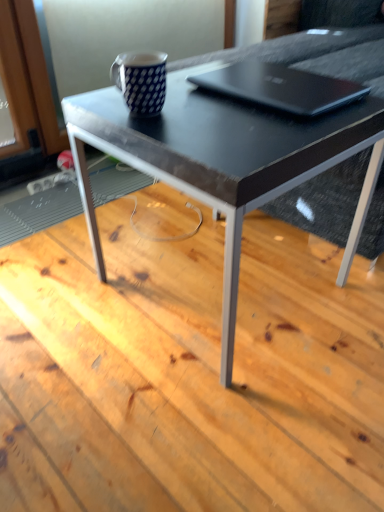
What do you see at coordinates (129, 34) in the screenshot?
I see `blue dotted mug at upper center` at bounding box center [129, 34].

What do you see at coordinates (224, 161) in the screenshot? This screenshot has width=384, height=512. I see `black glossy table at center` at bounding box center [224, 161].

The width and height of the screenshot is (384, 512). Find the location of `blue dotted mug at upper center`. blue dotted mug at upper center is located at coordinates (141, 81).

Find the location of a particular element. This screenshot has width=384, height=512. coffee cup positioned vertically above the black glossy table at center (from a real-world perspective) is located at coordinates click(141, 81).

Is black glossy table at center a part of blue dotted mug at upper center?

No, black glossy table at center is located outside of blue dotted mug at upper center.

Is blue dotted mug at upper center shorter than black glossy table at center?

Correct, blue dotted mug at upper center is not as tall as black glossy table at center.

In the image, is blue dotted mug at upper center on the left side or the right side of black glossy table at center?

From the image, it's evident that blue dotted mug at upper center is to the left of black glossy table at center.

Considering the sizes of black matte laptop at upper center and blue dotted mug at upper center in the image, is black matte laptop at upper center taller or shorter than blue dotted mug at upper center?

In the image, black matte laptop at upper center appears to be shorter than blue dotted mug at upper center.

What are the coordinates of `laptop below the blue dotted mug at upper center (from a real-world perspective)` in the screenshot? It's located at (281, 87).

Can blue dotted mug at upper center be found inside black matte laptop at upper center?

No, blue dotted mug at upper center is not inside black matte laptop at upper center.

Is black matte laptop at upper center in contact with blue dotted mug at upper center?

There is a gap between black matte laptop at upper center and blue dotted mug at upper center.

Is blue dotted mug at upper center wider than blue dotted mug at upper center?

In fact, blue dotted mug at upper center might be narrower than blue dotted mug at upper center.

Which of these two, blue dotted mug at upper center or blue dotted mug at upper center, is bigger?

Bigger between the two is blue dotted mug at upper center.

From the image's perspective, which is above, blue dotted mug at upper center or blue dotted mug at upper center?

blue dotted mug at upper center appears higher in the image.

Is blue dotted mug at upper center at the back of blue dotted mug at upper center?

No, blue dotted mug at upper center is not facing the opposite direction of blue dotted mug at upper center.

In terms of height, does black glossy table at center look taller or shorter compared to blue dotted mug at upper center?

Clearly, black glossy table at center is shorter compared to blue dotted mug at upper center.

Is black glossy table at center situated inside blue dotted mug at upper center or outside?

black glossy table at center is not enclosed by blue dotted mug at upper center.

From a real-world perspective, relative to blue dotted mug at upper center, is black glossy table at center vertically above or below?

From a real-world perspective, black glossy table at center is physically below blue dotted mug at upper center.

Between point (89, 136) and point (106, 0), which one is positioned in front?

The point (89, 136) is in front.

From their relative heights in the image, would you say blue dotted mug at upper center is taller or shorter than black matte laptop at upper center?

blue dotted mug at upper center is taller than black matte laptop at upper center.

Find the location of a particular element. The width and height of the screenshot is (384, 512). coffee cup on the left of the black matte laptop at upper center is located at coordinates (141, 81).

Is blue dotted mug at upper center bigger or smaller than black matte laptop at upper center?

Clearly, blue dotted mug at upper center is smaller in size than black matte laptop at upper center.

Is blue dotted mug at upper center positioned beyond the bounds of black matte laptop at upper center?

Absolutely, blue dotted mug at upper center is external to black matte laptop at upper center.

Is blue dotted mug at upper center touching black glossy table at center?

There is a gap between blue dotted mug at upper center and black glossy table at center.

Based on their positions, is blue dotted mug at upper center located to the left or right of black glossy table at center?

Based on their positions, blue dotted mug at upper center is located to the left of black glossy table at center.

Can you tell me how much blue dotted mug at upper center and black glossy table at center differ in facing direction?

0.0543 degrees separate the facing orientations of blue dotted mug at upper center and black glossy table at center.

Is the surface of black matte laptop at upper center in direct contact with black glossy table at center?

No, black matte laptop at upper center is not beside black glossy table at center.

From a real-world perspective, is black matte laptop at upper center on black glossy table at center?

Yes.

Is black matte laptop at upper center bigger than black glossy table at center?

Incorrect, black matte laptop at upper center is not larger than black glossy table at center.

Which object is wider, black matte laptop at upper center or black glossy table at center?

black glossy table at center.

The width and height of the screenshot is (384, 512). What are the coordinates of `coffee cup located behind the black glossy table at center` in the screenshot? It's located at tap(141, 81).

You are a GUI agent. You are given a task and a screenshot of the screen. Output one action in this format:
    pyautogui.click(x=<x>, y=<y>)
    Task: Click on the laptop directly beneath the blue dotted mug at upper center (from a real-world perspective)
    Image resolution: width=384 pixels, height=512 pixels.
    Given the screenshot: What is the action you would take?
    pyautogui.click(x=281, y=87)

Estimate the real-world distances between objects in this image. Which object is further from blue dotted mug at upper center, black glossy table at center or blue dotted mug at upper center?

blue dotted mug at upper center lies further to blue dotted mug at upper center than the other object.

Based on the photo, based on their spatial positions, is blue dotted mug at upper center or black matte laptop at upper center further from blue dotted mug at upper center?

blue dotted mug at upper center lies further to blue dotted mug at upper center than the other object.

Considering their positions, is blue dotted mug at upper center positioned closer to black matte laptop at upper center than black glossy table at center?

black glossy table at center is closer to black matte laptop at upper center.

When comparing their distances from blue dotted mug at upper center, does blue dotted mug at upper center or black glossy table at center seem closer?

black glossy table at center is positioned closer to the anchor blue dotted mug at upper center.

Based on their spatial positions, is black glossy table at center or black matte laptop at upper center closer to blue dotted mug at upper center?

The object closer to blue dotted mug at upper center is black matte laptop at upper center.

Based on their spatial positions, is black matte laptop at upper center or black glossy table at center further from blue dotted mug at upper center?

black matte laptop at upper center lies further to blue dotted mug at upper center than the other object.

Looking at the image, which one is located closer to blue dotted mug at upper center, black glossy table at center or black matte laptop at upper center?

The object closer to blue dotted mug at upper center is black glossy table at center.

Looking at the image, which one is located further to black matte laptop at upper center, blue dotted mug at upper center or black glossy table at center?

The object further to black matte laptop at upper center is blue dotted mug at upper center.

Locate an element on the screen. This screenshot has width=384, height=512. laptop between black glossy table at center and blue dotted mug at upper center in the front-back direction is located at coordinates (281, 87).

Locate an element on the screen. coffee cup located between black glossy table at center and blue dotted mug at upper center in the depth direction is located at coordinates (141, 81).

Locate an element on the screen. This screenshot has height=512, width=384. coffee table between blue dotted mug at upper center and black matte laptop at upper center in the horizontal direction is located at coordinates (224, 161).

The width and height of the screenshot is (384, 512). In order to click on laptop positioned between blue dotted mug at upper center and blue dotted mug at upper center from near to far in this screenshot , I will do `click(281, 87)`.